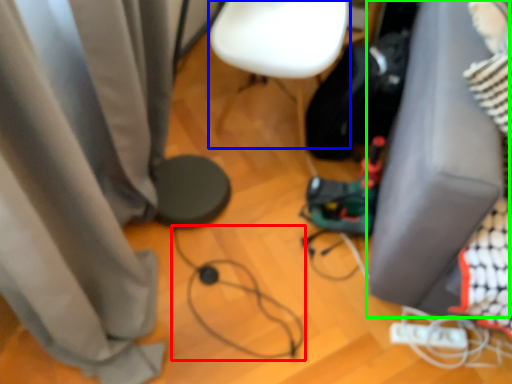
Question: Based on their relative distances, which object is nearer to wire (highlighted by a red box)? Choose from armchair (highlighted by a blue box) and furniture (highlighted by a green box).

Choices:
 (A) armchair
 (B) furniture

Answer: (B)